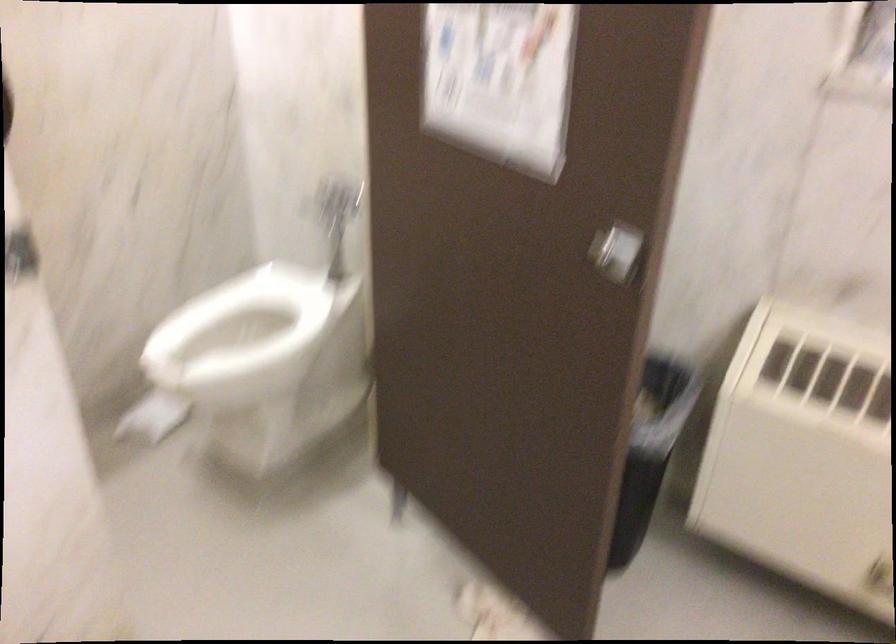
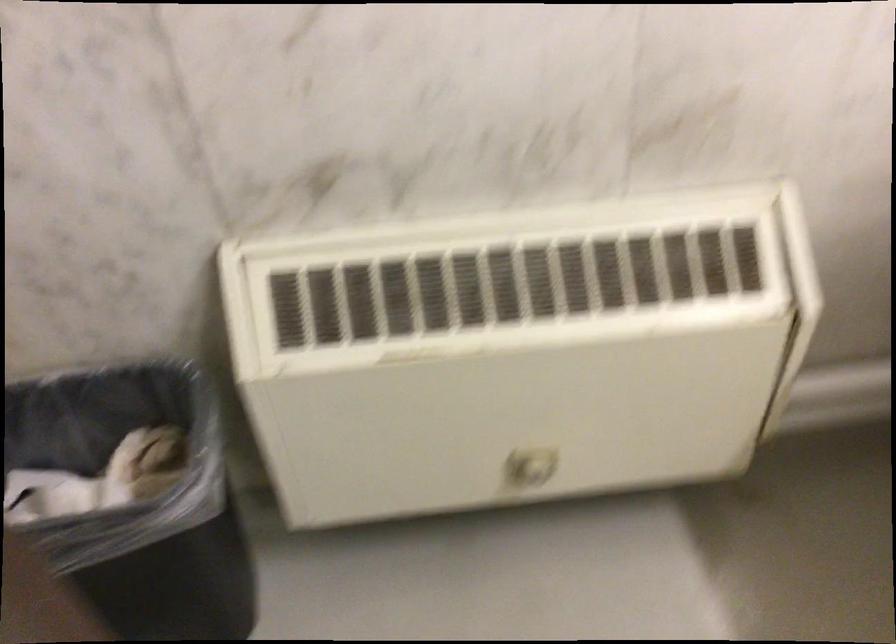
Based on the continuous images, in which direction is the camera rotating?

The rotation direction of the camera is right-down.